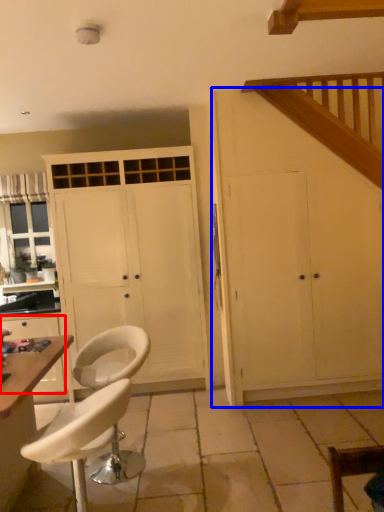
Question: Which object is closer to the camera taking this photo, cabinetry (highlighted by a red box) or cupboard (highlighted by a blue box)?

Choices:
 (A) cabinetry
 (B) cupboard

Answer: (B)